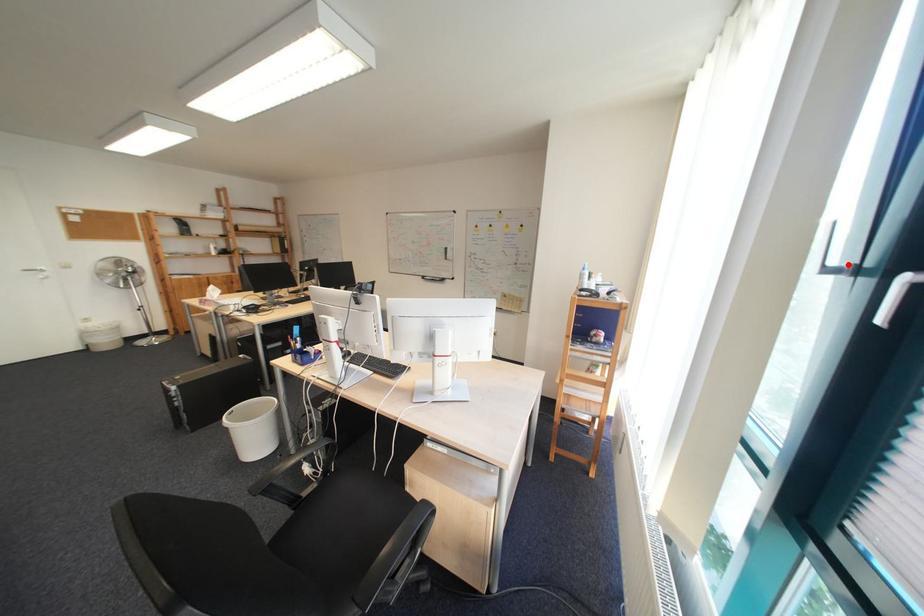
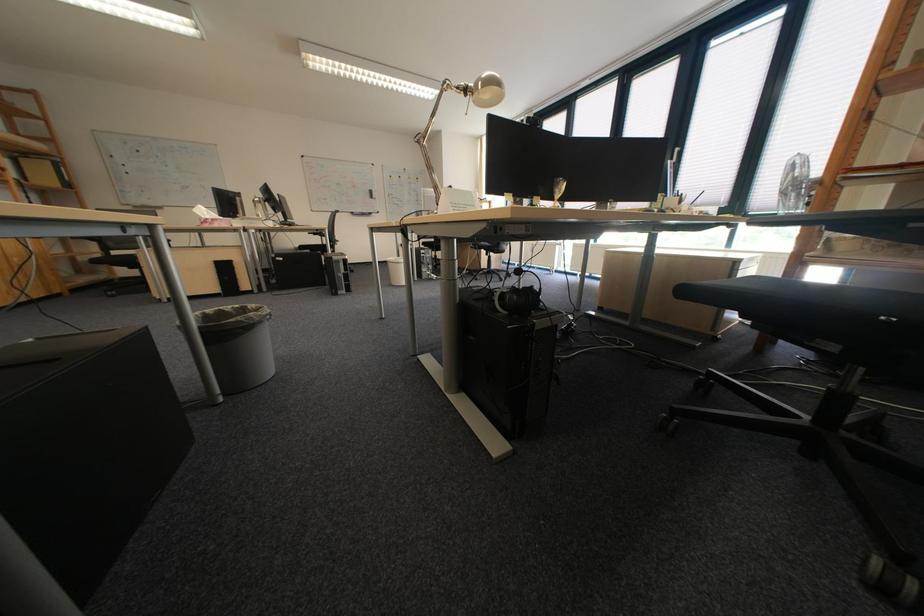
Question: I am providing you with two images of the same scene from different viewpoints. A red point is marked on the first image. At the location where the point appears in image 1, is it still visible in image 2?

Choices:
 (A) Yes
 (B) No

Answer: (B)